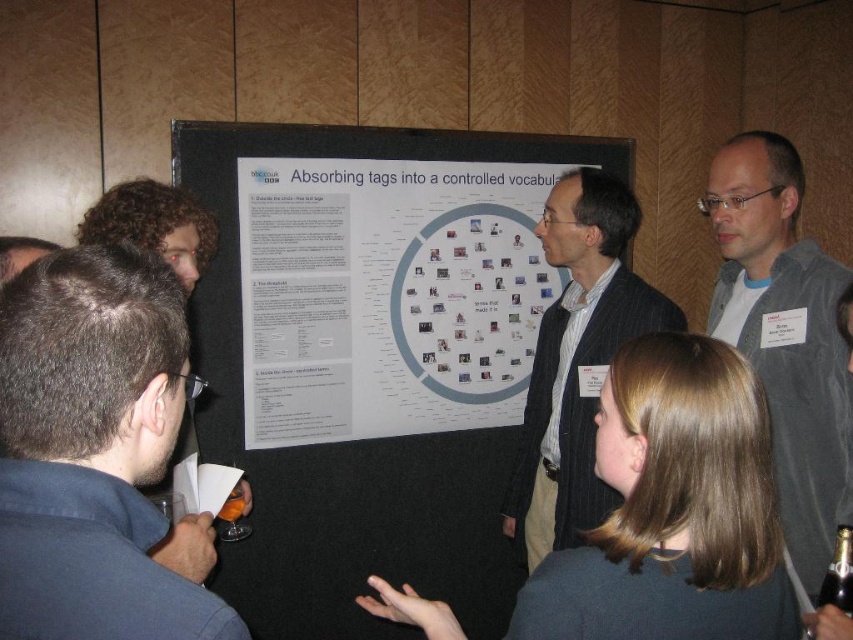
In the scene shown: You are organizing a seating arrangement for a workshop and need to ensure there is enough space between participants. If the dark blue shirt at lower left and the gray fabric jacket at right are sitting side by side, which person requires more space due to their clothing?

The dark blue shirt at lower left requires more space because its width is larger than the gray fabric jacket at right.

You are organizing a conference and need to ensure that all materials fit on a display table. The table can only accommodate items up to the size of the dark blue shirt at lower left. Can the white paperboard poster at center be placed on the table without exceeding the table size limit?

The white paperboard poster at center is larger in size than the dark blue shirt at lower left. Since the table can only accommodate items up to the size of the dark blue shirt at lower left, the white paperboard poster at center cannot be placed on the table without exceeding the size limit.

You are a presenter standing in front of the white paperboard poster at center and the striped suit jacket at center. You need to move a microphone from the poster to the jacket. Can you do this without moving more than 2 feet?

The distance between the white paperboard poster at center and the striped suit jacket at center is 22.51 inches, which is less than 2 feet. Yes, you can move the microphone without exceeding the distance.